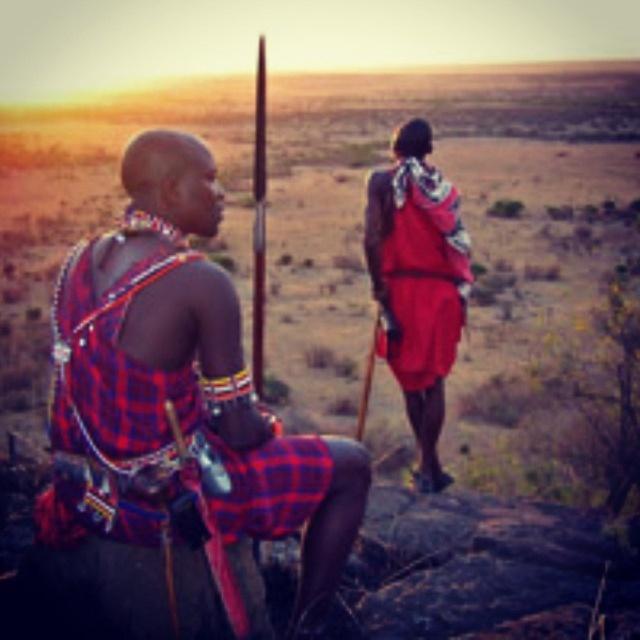
You are a photographer positioned at the center of the scene. You want to capture a photo that includes both the plaid fabric shirt at left and the red woven cloth at rear. Which object should you adjust your camera angle to focus on first to ensure both are in frame?

Result: The plaid fabric shirt at left is in front of the red woven cloth at rear, so you should focus on the plaid fabric shirt at left first to ensure both are in frame.

You are standing at point A which is at coordinate point (x=433, y=200) and want to walk towards point B which is at coordinate point (x=353, y=522). Which direction should you go?

You should walk towards the direction of point B at coordinate point (x=353, y=522), which is in front of point A at coordinate point (x=433, y=200).

Consider the image. You are an anthropologist studying traditional clothing. You observe the plaid fabric shirt at left and the red woven cloth at rear in the scene. Which of these two items has a taller height?

The plaid fabric shirt at left has a greater height compared to the red woven cloth at rear.